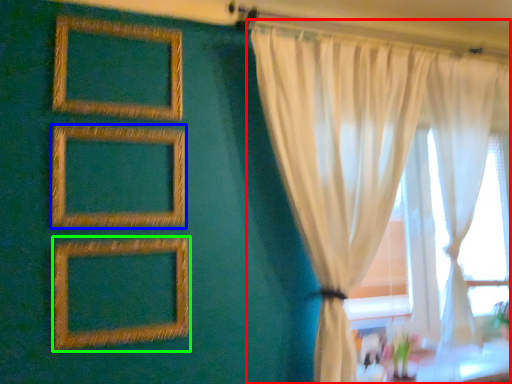
Question: Which object is the farthest from curtain (highlighted by a red box)? Choose among these: picture frame (highlighted by a blue box) or picture frame (highlighted by a green box).

Choices:
 (A) picture frame
 (B) picture frame

Answer: (B)